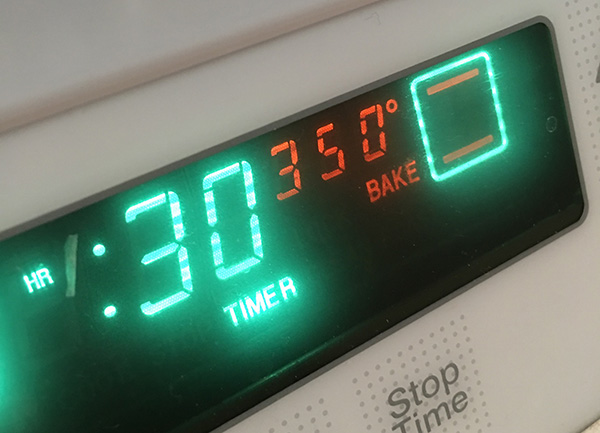
Identify the location of top of clock. (266, 65).